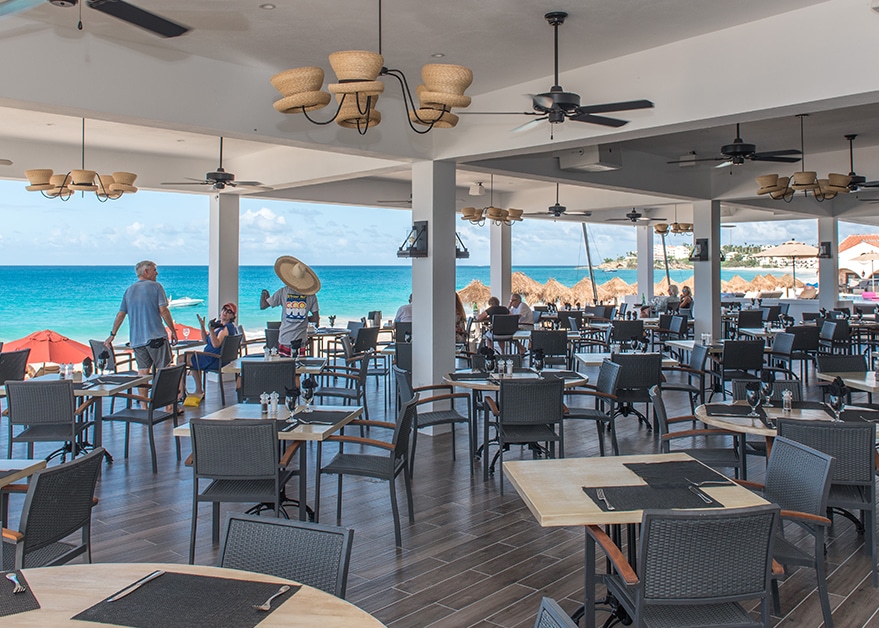
The height and width of the screenshot is (628, 879). I want to click on table, so click(x=562, y=506).